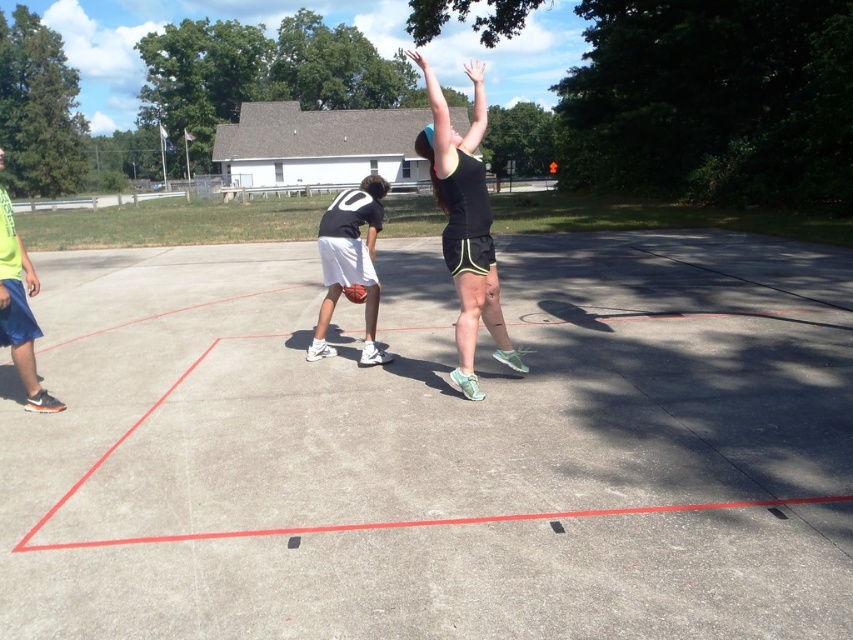
Question: Considering the real-world distances, which object is closest to the black matte basketball at center?

Choices:
 (A) glossy orange basketball at center
 (B) neon green t-shirt at left
 (C) black matte shorts at center
 (D) concrete at center

Answer: (A)

Question: Which object is farther from the camera taking this photo?

Choices:
 (A) neon green t-shirt at left
 (B) black matte basketball at center
 (C) concrete at center

Answer: (B)

Question: Can you confirm if black matte shorts at center is positioned above glossy orange basketball at center?

Choices:
 (A) yes
 (B) no

Answer: (A)

Question: In this image, where is neon green t-shirt at left located relative to glossy orange basketball at center?

Choices:
 (A) left
 (B) right

Answer: (A)

Question: Is black matte shorts at center below neon green t-shirt at left?

Choices:
 (A) yes
 (B) no

Answer: (B)

Question: Which of these objects is positioned closest to the concrete at center?

Choices:
 (A) black matte basketball at center
 (B) neon green t-shirt at left
 (C) black matte shorts at center

Answer: (A)